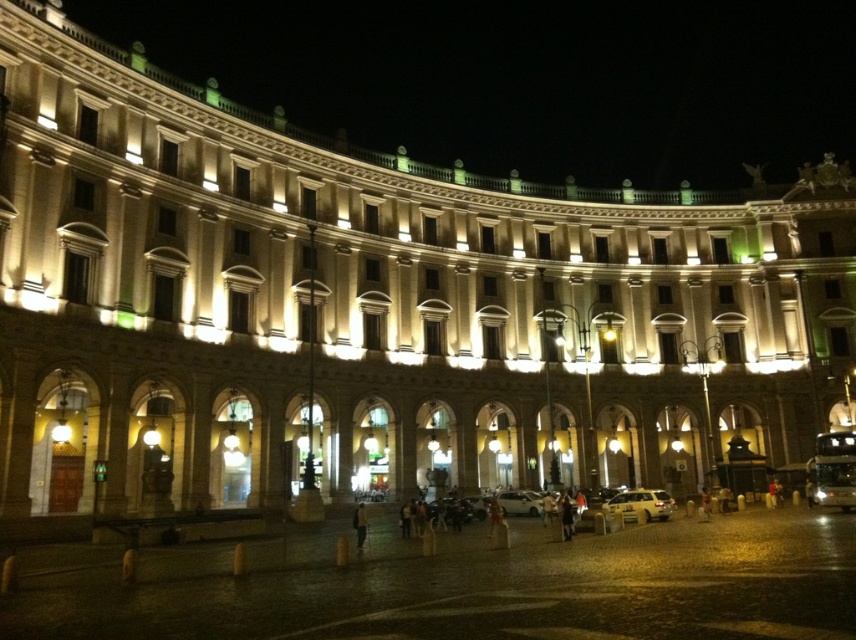
Question: Is yellow metallic car at lower right smaller than white matte car at center?

Choices:
 (A) yes
 (B) no

Answer: (B)

Question: Is white matte car at center wider than dark brown leather jacket at center?

Choices:
 (A) no
 (B) yes

Answer: (B)

Question: Can you confirm if yellow metallic car at lower right is positioned to the left of white matte car at center?

Choices:
 (A) yes
 (B) no

Answer: (B)

Question: Which of the following is the closest to the observer?

Choices:
 (A) (361, 538)
 (B) (515, 497)
 (C) (629, 496)

Answer: (A)

Question: Among these points, which one is farthest from the camera?

Choices:
 (A) (354, 518)
 (B) (617, 502)
 (C) (510, 497)

Answer: (C)

Question: Which object appears closest to the camera in this image?

Choices:
 (A) white matte car at center
 (B) yellow metallic car at lower right

Answer: (A)